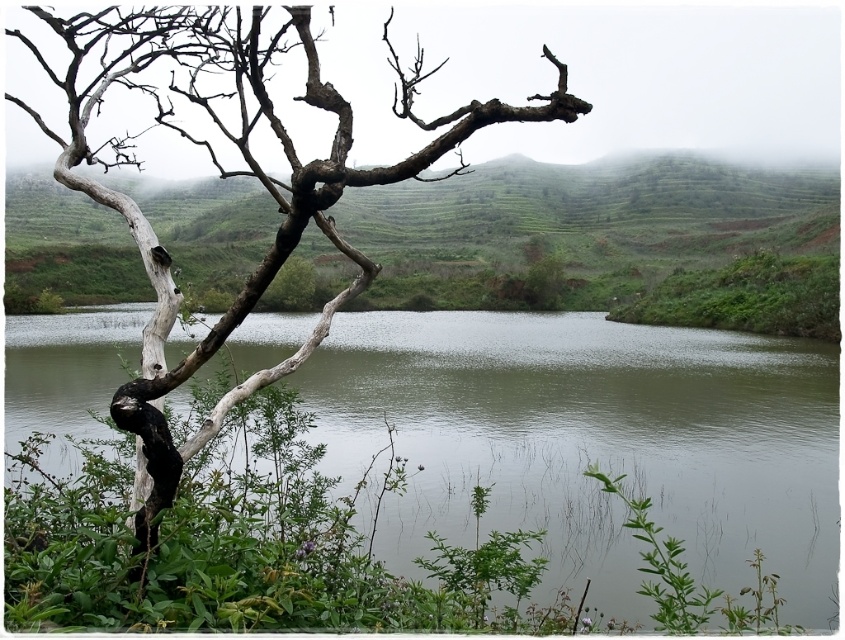
Question: Among these points, which one is farthest from the camera?

Choices:
 (A) (707, 259)
 (B) (30, 49)
 (C) (791, 460)

Answer: (A)

Question: Considering the relative positions of green smooth water at center and white rough branch at left in the image provided, where is green smooth water at center located with respect to white rough branch at left?

Choices:
 (A) above
 (B) below

Answer: (B)

Question: Is green grassy hillside at upper center smaller than white rough branch at left?

Choices:
 (A) yes
 (B) no

Answer: (B)

Question: Which point is farther from the camera taking this photo?

Choices:
 (A) pyautogui.click(x=402, y=106)
 (B) pyautogui.click(x=829, y=417)

Answer: (B)

Question: Can you confirm if green smooth water at center is positioned to the left of green grassy hillside at upper center?

Choices:
 (A) no
 (B) yes

Answer: (B)

Question: Which point is farther to the camera?

Choices:
 (A) green grassy hillside at upper center
 (B) white rough branch at left
 (C) green smooth water at center

Answer: (C)